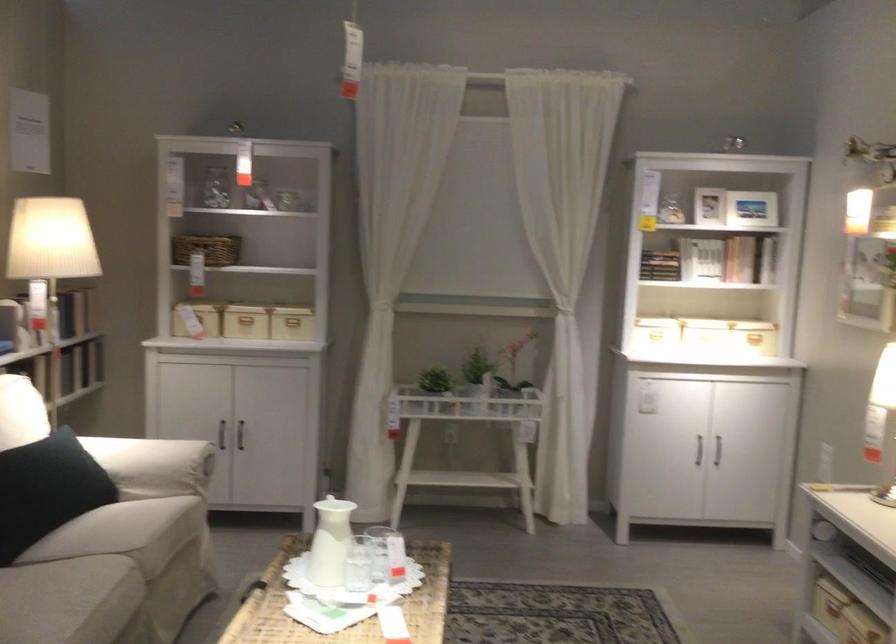
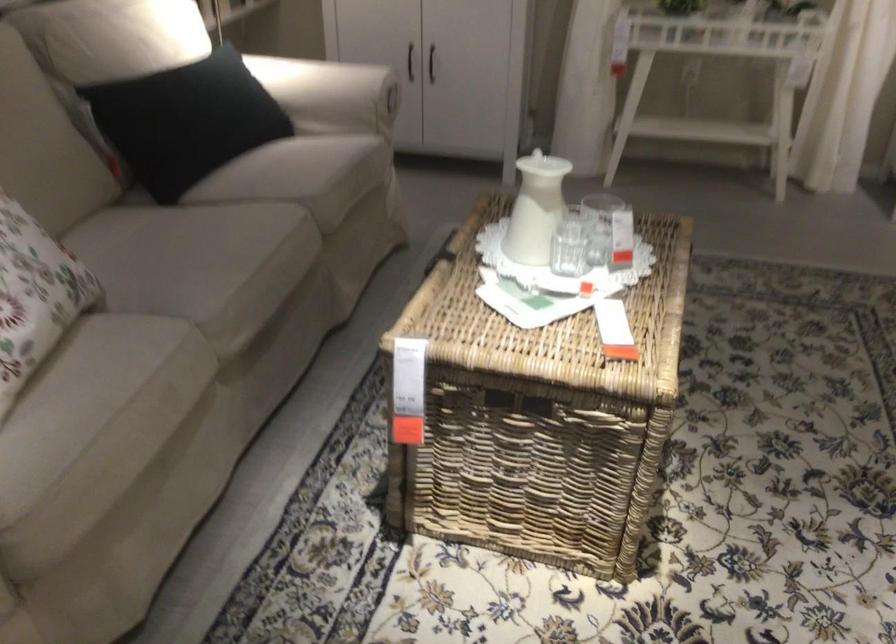
Question: Which direction would the cameraman need to move to produce the second image? Reply with the corresponding letter.

Choices:
 (A) Left
 (B) Right
 (C) Forward
 (D) Backward

Answer: (C)